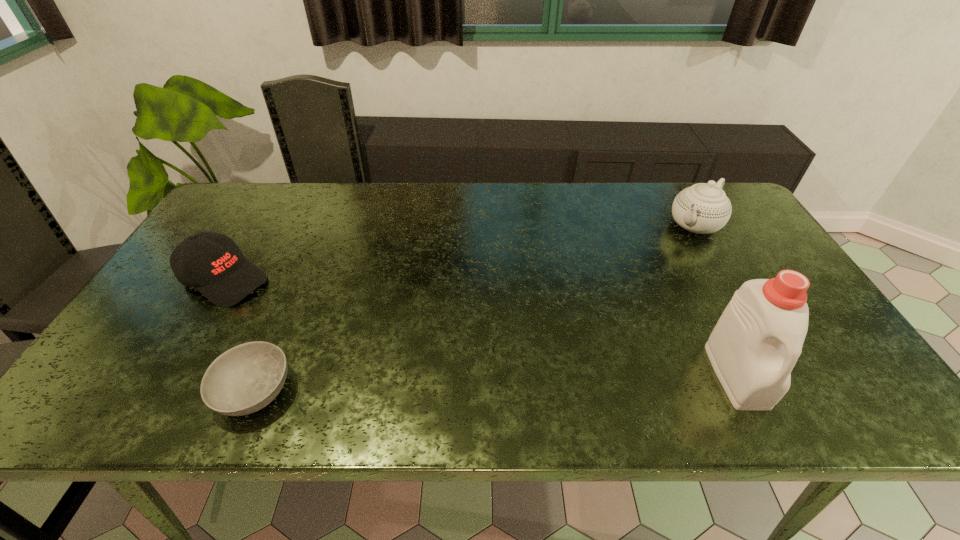
In the image, there is a desktop. Find the location of `vacant space at the near edge`. vacant space at the near edge is located at coordinates (464, 346).

Identify the location of free spot at the left edge of the desktop. This screenshot has width=960, height=540. (179, 282).

This screenshot has width=960, height=540. What are the coordinates of `vacant position at the right edge of the desktop` in the screenshot? It's located at (714, 245).

The width and height of the screenshot is (960, 540). Find the location of `vacant space at the far right corner`. vacant space at the far right corner is located at coordinates (753, 224).

The width and height of the screenshot is (960, 540). I want to click on empty space that is in between the third object from right to left and the leftmost object, so click(240, 335).

Image resolution: width=960 pixels, height=540 pixels. Identify the location of vacant space in between the shortest object and the second farthest object. (240, 335).

Identify the location of vacant point located between the second shortest object and the second object from left to right. This screenshot has height=540, width=960. (240, 335).

This screenshot has width=960, height=540. I want to click on vacant area that lies between the third object from right to left and the tallest object, so click(x=495, y=383).

What are the coordinates of `blank region between the third object from right to left and the detergent` in the screenshot? It's located at (495, 383).

Image resolution: width=960 pixels, height=540 pixels. Find the location of `vacant point located between the shortest object and the tallest object`. vacant point located between the shortest object and the tallest object is located at coordinates (495, 383).